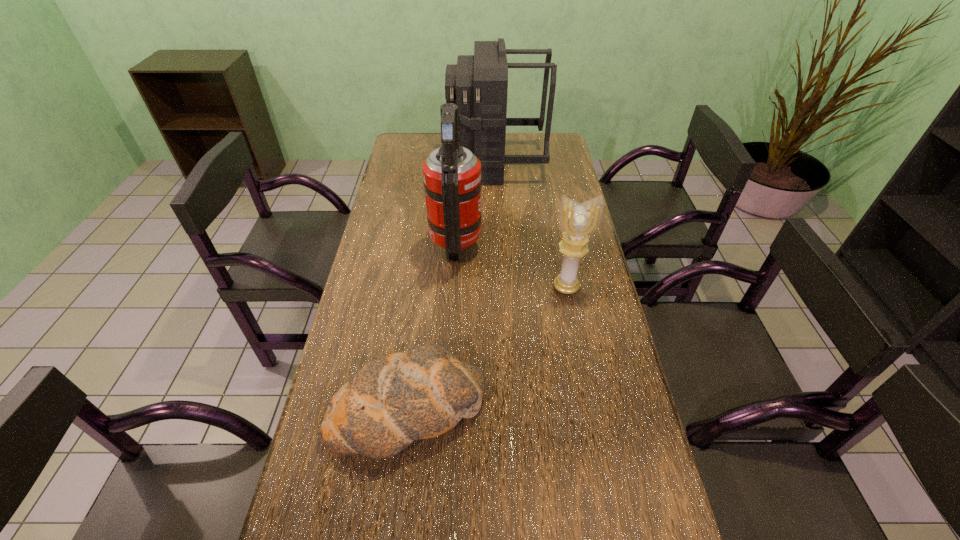
What are the coordinates of `vacant point located 0.150m on the front-facing side of the second shortest object` in the screenshot? It's located at (576, 338).

The height and width of the screenshot is (540, 960). Identify the location of vacant position located on the back of the nearest object. (423, 282).

Identify the location of object present at the far edge. The width and height of the screenshot is (960, 540). (478, 84).

You are a GUI agent. You are given a task and a screenshot of the screen. Output one action in this format:
    pyautogui.click(x=<x>, y=<y>)
    Task: Click on the object located at the left edge
    The height and width of the screenshot is (540, 960).
    Given the screenshot: What is the action you would take?
    pyautogui.click(x=393, y=399)

Identify the location of backpack that is at the right edge. (478, 84).

Locate an element on the screen. The height and width of the screenshot is (540, 960). award that is at the right edge is located at coordinates (578, 221).

Identify the location of object present at the far right corner. (478, 84).

The height and width of the screenshot is (540, 960). I want to click on blank area at the left edge, so click(x=393, y=259).

Find the location of a particular element. This screenshot has height=540, width=960. free space at the right edge is located at coordinates (562, 346).

I want to click on vacant space at the far right corner of the desktop, so click(x=558, y=152).